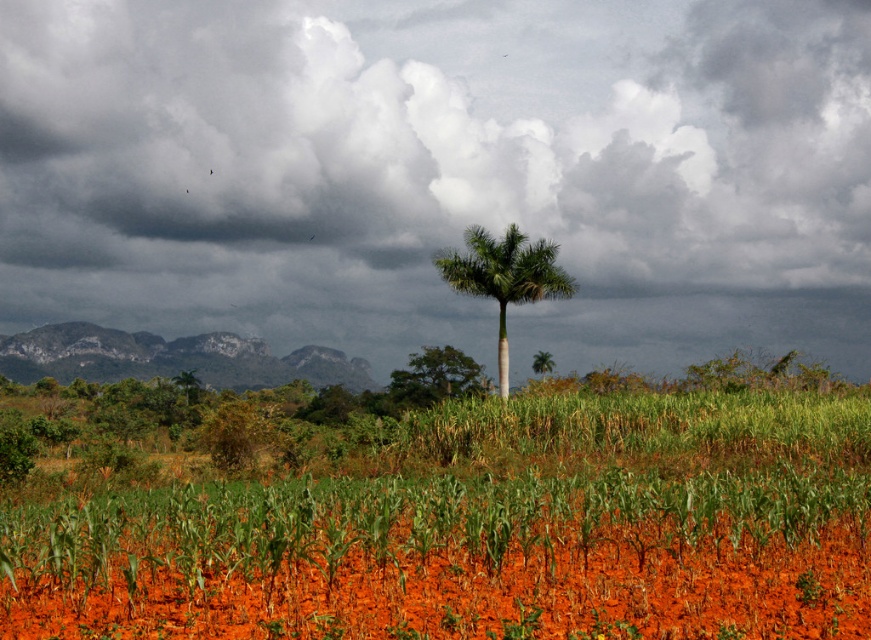
Question: Which of the following is the farthest from the observer?

Choices:
 (A) red clay soil at center
 (B) green leafy palm at center
 (C) rocky cliff at left
 (D) green leafy tree at center

Answer: (C)

Question: Is rocky cliff at left bigger than green leafy palm at center?

Choices:
 (A) no
 (B) yes

Answer: (B)

Question: Is red clay soil at center behind rocky cliff at left?

Choices:
 (A) no
 (B) yes

Answer: (A)

Question: Which of these objects is positioned closest to the red clay soil at center?

Choices:
 (A) rocky cliff at left
 (B) green leafy palm at center

Answer: (B)

Question: Does red clay soil at center appear over green leafy palm at center?

Choices:
 (A) yes
 (B) no

Answer: (B)

Question: Which object is the farthest from the red clay soil at center?

Choices:
 (A) rocky cliff at left
 (B) green leafy tree at center

Answer: (A)